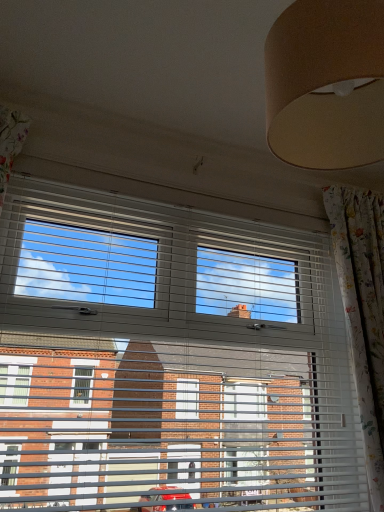
Describe the element at coordinates (169, 357) in the screenshot. I see `white plastic blinds at center` at that location.

Locate an element on the screen. The width and height of the screenshot is (384, 512). white plastic blinds at center is located at coordinates (169, 357).

In order to face floral fabric curtain at right, should I rotate leftwards or rightwards?

To face it directly, rotate right by 24.410 degrees.

In order to click on floral fabric curtain at right in this screenshot , I will do `click(363, 311)`.

What is the approximate height of floral fabric curtain at right?

The height of floral fabric curtain at right is 4.15 feet.

Image resolution: width=384 pixels, height=512 pixels. Describe the element at coordinates (363, 311) in the screenshot. I see `floral fabric curtain at right` at that location.

At what (x,y) coordinates should I click in order to perform the action: click on white plastic blinds at center. Please return your answer as a coordinate pair (x, y). The width and height of the screenshot is (384, 512). Looking at the image, I should click on (169, 357).

Can you confirm if white plastic blinds at center is positioned to the left of floral fabric curtain at right?

Correct, you'll find white plastic blinds at center to the left of floral fabric curtain at right.

Between white plastic blinds at center and floral fabric curtain at right, which one is positioned behind?

floral fabric curtain at right is more distant.

Which is in front, point (41, 499) or point (360, 328)?

The point (41, 499) is closer.

From the image's perspective, is white plastic blinds at center beneath floral fabric curtain at right?

No, from the image's perspective, white plastic blinds at center is not beneath floral fabric curtain at right.

From a real-world perspective, is white plastic blinds at center above or below floral fabric curtain at right?

white plastic blinds at center is situated lower than floral fabric curtain at right in the real world.

Can you confirm if white plastic blinds at center is thinner than floral fabric curtain at right?

Correct, the width of white plastic blinds at center is less than that of floral fabric curtain at right.

Considering the sizes of white plastic blinds at center and floral fabric curtain at right in the image, is white plastic blinds at center taller or shorter than floral fabric curtain at right?

white plastic blinds at center is shorter than floral fabric curtain at right.

Is white plastic blinds at center bigger or smaller than floral fabric curtain at right?

Clearly, white plastic blinds at center is larger in size than floral fabric curtain at right.

Is floral fabric curtain at right completely or partially inside white plastic blinds at center?

No, white plastic blinds at center does not contain floral fabric curtain at right.

Looking at this image, is white plastic blinds at center far away from floral fabric curtain at right?

No, white plastic blinds at center is not far away from floral fabric curtain at right.

Does white plastic blinds at center turn towards floral fabric curtain at right?

Yes, white plastic blinds at center is aimed at floral fabric curtain at right.

What's the angular difference between white plastic blinds at center and floral fabric curtain at right's facing directions?

The angular difference between white plastic blinds at center and floral fabric curtain at right is 1.29 degrees.

At what (x,y) coordinates should I click in order to perform the action: click on curtain behind the white plastic blinds at center. Please return your answer as a coordinate pair (x, y). This screenshot has width=384, height=512. Looking at the image, I should click on (363, 311).

Considering the relative positions of floral fabric curtain at right and white plastic blinds at center in the image provided, is floral fabric curtain at right to the left of white plastic blinds at center from the viewer's perspective?

Incorrect, floral fabric curtain at right is not on the left side of white plastic blinds at center.

Consider the image. In the image, is floral fabric curtain at right positioned in front of or behind white plastic blinds at center?

Visually, floral fabric curtain at right is located behind white plastic blinds at center.

Considering the positions of points (340, 205) and (238, 255), is point (340, 205) closer to camera compared to point (238, 255)?

No, (340, 205) is further to viewer.

From the image's perspective, is floral fabric curtain at right beneath white plastic blinds at center?

Correct, floral fabric curtain at right appears lower than white plastic blinds at center in the image.

From a real-world perspective, which is physically below, floral fabric curtain at right or white plastic blinds at center?

white plastic blinds at center, from a real-world perspective.

Which object is thinner, floral fabric curtain at right or white plastic blinds at center?

With smaller width is white plastic blinds at center.

Is floral fabric curtain at right taller or shorter than white plastic blinds at center?

Considering their sizes, floral fabric curtain at right has more height than white plastic blinds at center.

Considering the sizes of objects floral fabric curtain at right and white plastic blinds at center in the image provided, who is bigger, floral fabric curtain at right or white plastic blinds at center?

white plastic blinds at center is bigger.

Choose the correct answer: Is floral fabric curtain at right inside white plastic blinds at center or outside it?

floral fabric curtain at right is not inside white plastic blinds at center, it's outside.

Is floral fabric curtain at right beside white plastic blinds at center?

No, floral fabric curtain at right is not beside white plastic blinds at center.

Does floral fabric curtain at right turn towards white plastic blinds at center?

No, floral fabric curtain at right is not aimed at white plastic blinds at center.

How different are the orientations of floral fabric curtain at right and white plastic blinds at center in degrees?

The angular difference between floral fabric curtain at right and white plastic blinds at center is 1.29 degrees.

Measure the distance between floral fabric curtain at right and white plastic blinds at center.

The distance of floral fabric curtain at right from white plastic blinds at center is 21.63 inches.

Find the location of a particular element. curtain behind the white plastic blinds at center is located at coordinates (363, 311).

The image size is (384, 512). What are the coordinates of `window on the left side of floral fabric curtain at right` in the screenshot? It's located at (169, 357).

Find the location of a particular element. This screenshot has height=512, width=384. window directly beneath the floral fabric curtain at right (from a real-world perspective) is located at coordinates (169, 357).